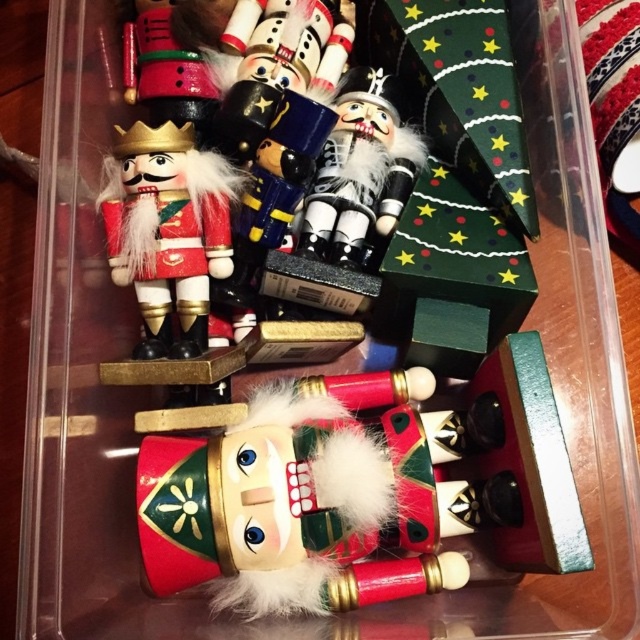
Question: Is matte red wood nutcracker at center closer to the viewer compared to matte black nutcracker at center?

Choices:
 (A) no
 (B) yes

Answer: (B)

Question: Does matte red wood nutcracker at center have a lesser width compared to matte black nutcracker at center?

Choices:
 (A) no
 (B) yes

Answer: (A)

Question: Estimate the real-world distances between objects in this image. Which object is farther from the matte red wood nutcracker at center?

Choices:
 (A) wooden nutcracker at left
 (B) matte black nutcracker at center

Answer: (B)

Question: Which of the following is the farthest from the observer?

Choices:
 (A) (426, 152)
 (B) (257, 396)

Answer: (A)

Question: Does matte red wood nutcracker at center have a lesser width compared to matte black nutcracker at center?

Choices:
 (A) no
 (B) yes

Answer: (A)

Question: Which point is farther to the camera?

Choices:
 (A) [340, 464]
 (B) [404, 152]

Answer: (B)